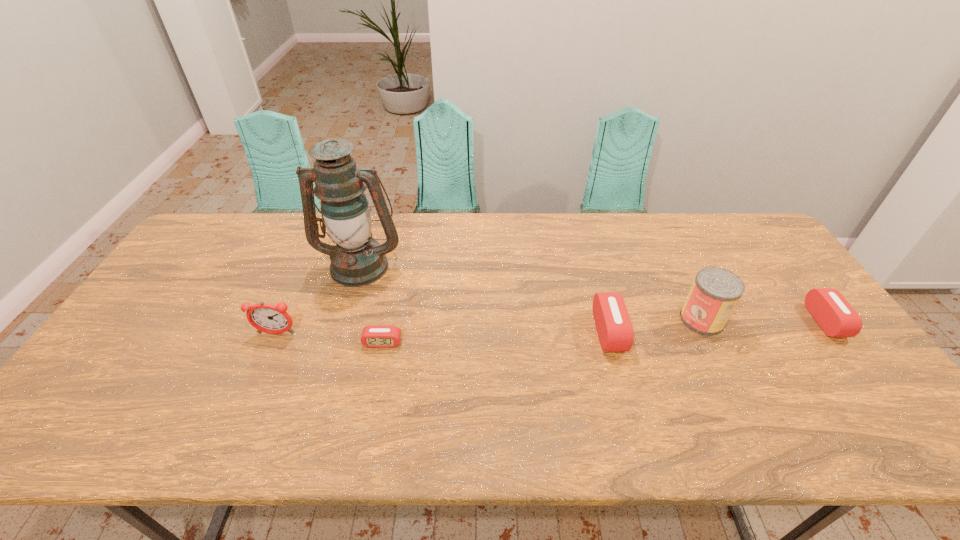
Find the location of a particular element. the shortest alarm clock is located at coordinates (373, 336).

Find the location of a particular element. The width and height of the screenshot is (960, 540). the third alarm clock from right to left is located at coordinates (373, 336).

I want to click on the third object from right to left, so click(x=613, y=324).

Locate an element on the screen. The image size is (960, 540). the fifth tallest object is located at coordinates (837, 318).

The height and width of the screenshot is (540, 960). Find the location of `the rightmost alarm clock`. the rightmost alarm clock is located at coordinates (837, 318).

Locate an element on the screen. Image resolution: width=960 pixels, height=540 pixels. the leftmost alarm clock is located at coordinates point(268,318).

Image resolution: width=960 pixels, height=540 pixels. Find the location of `the third tallest object`. the third tallest object is located at coordinates [x=268, y=318].

Where is `oil lamp`? This screenshot has height=540, width=960. oil lamp is located at coordinates (357, 260).

The width and height of the screenshot is (960, 540). I want to click on the farthest object, so click(x=357, y=260).

Where is `the fifth shortest object`? The width and height of the screenshot is (960, 540). the fifth shortest object is located at coordinates (715, 292).